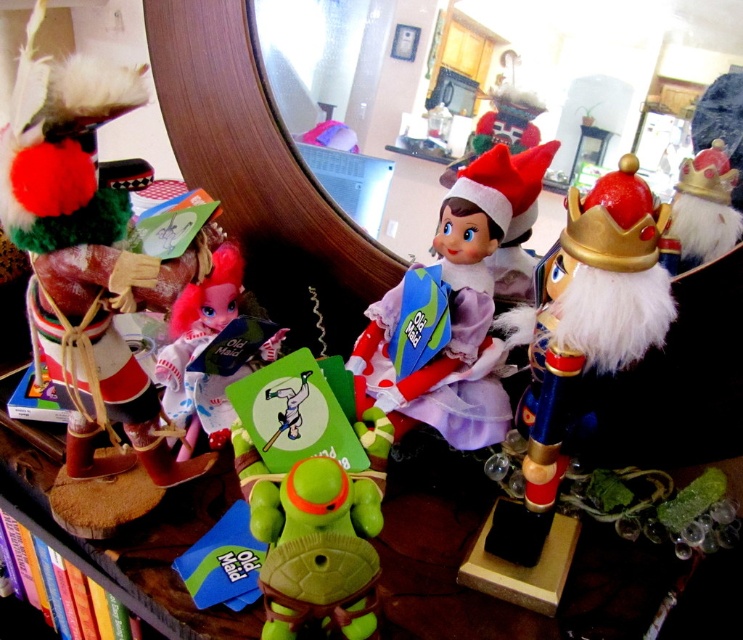
You are a delivery robot that needs to place a new figurine exactly at the center of the wooden surface. The current arrangement has a matte purple fabric doll at center. Based on its position, can you determine if the doll is already at the center of the surface?

The matte purple fabric doll at center is located at coordinates point (455, 307), which is very close to the center of the surface. Therefore, placing the new figurine exactly at the center would mean positioning it near the existing matte purple fabric doll at center.